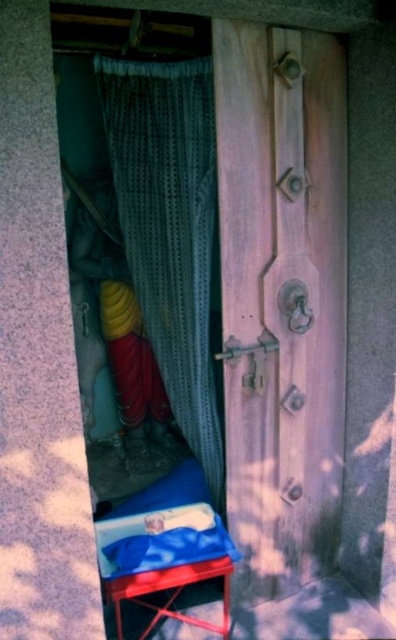
Question: Does wooden door at center have a lesser width compared to textured fabric curtain at center?

Choices:
 (A) yes
 (B) no

Answer: (B)

Question: Is wooden door at center thinner than metallic red stool at lower center?

Choices:
 (A) no
 (B) yes

Answer: (A)

Question: Which point is closer to the camera?

Choices:
 (A) wooden door at center
 (B) textured fabric curtain at center
 (C) metallic red stool at lower center

Answer: (A)

Question: Which object is closer to the camera taking this photo?

Choices:
 (A) wooden door at center
 (B) metallic red stool at lower center

Answer: (A)

Question: In this image, where is textured fabric curtain at center located relative to metallic red stool at lower center?

Choices:
 (A) right
 (B) left

Answer: (A)

Question: Which point is closer to the camera?

Choices:
 (A) textured fabric curtain at center
 (B) wooden door at center
 (C) metallic red stool at lower center

Answer: (B)